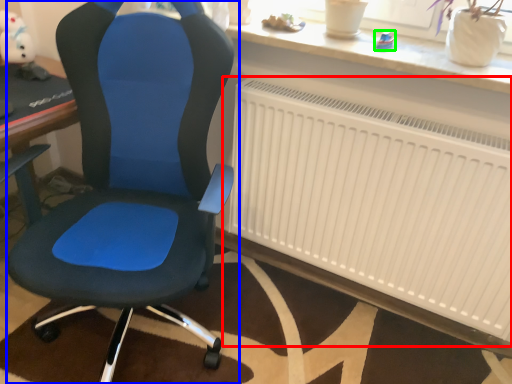
Question: Which object is the farthest from radiator (highlighted by a red box)? Choose among these: chair (highlighted by a blue box) or toy (highlighted by a green box).

Choices:
 (A) chair
 (B) toy

Answer: (B)